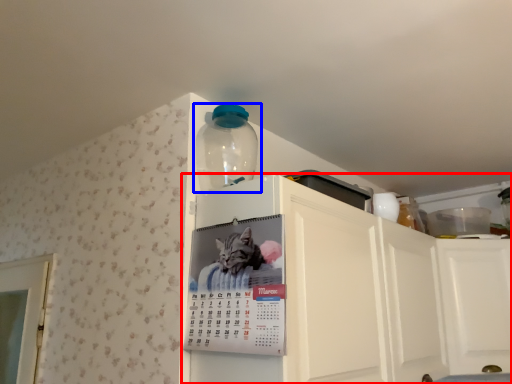
Question: Which of the following is the closest to the observer, cabinetry (highlighted by a red box) or bottle (highlighted by a blue box)?

Choices:
 (A) cabinetry
 (B) bottle

Answer: (A)